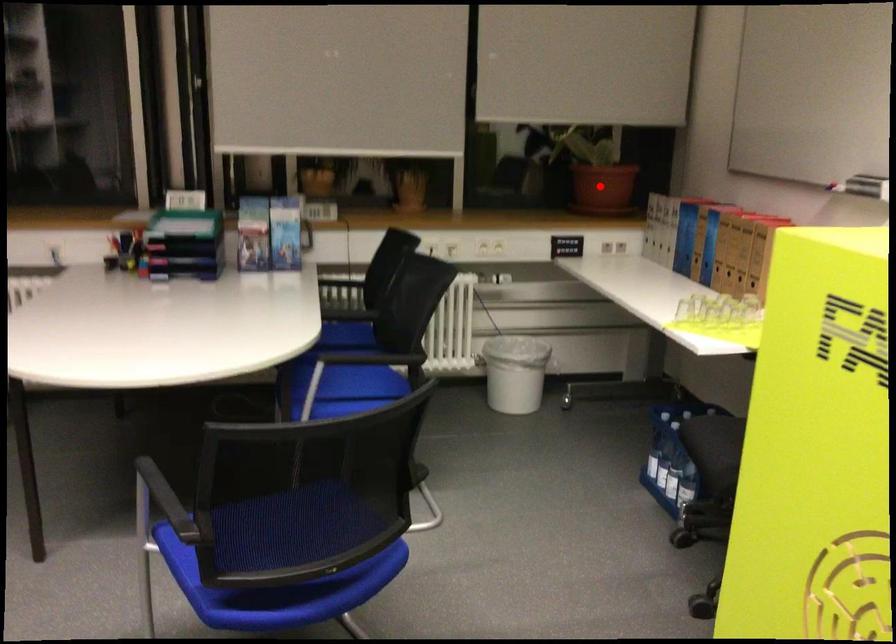
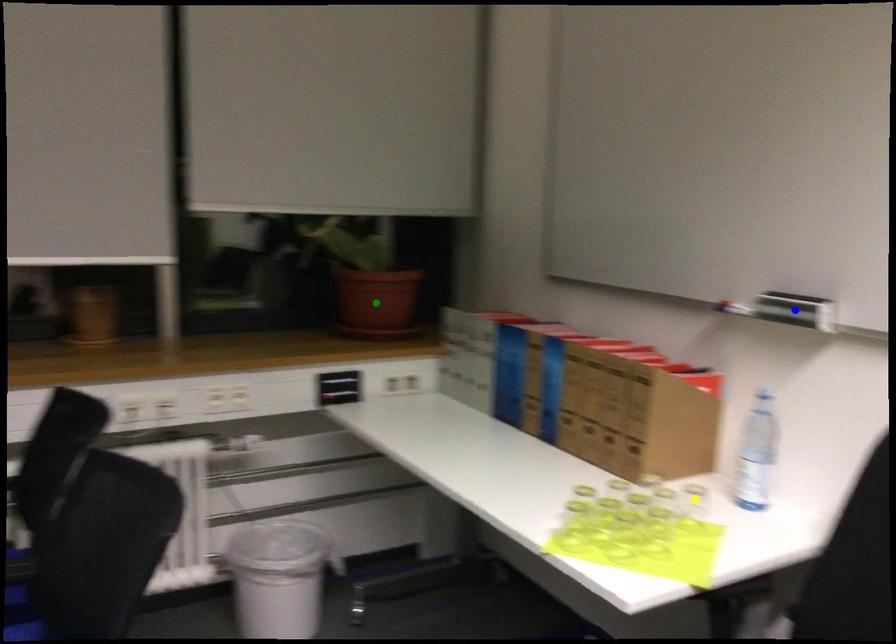
Question: I am providing you with two images of the same scene from different viewpoints. A red point is marked on the first image. You are given multiple points on the second image. Which spot in image 2 lines up with the point in image 1?

Choices:
 (A) green point
 (B) blue point
 (C) yellow point

Answer: (A)